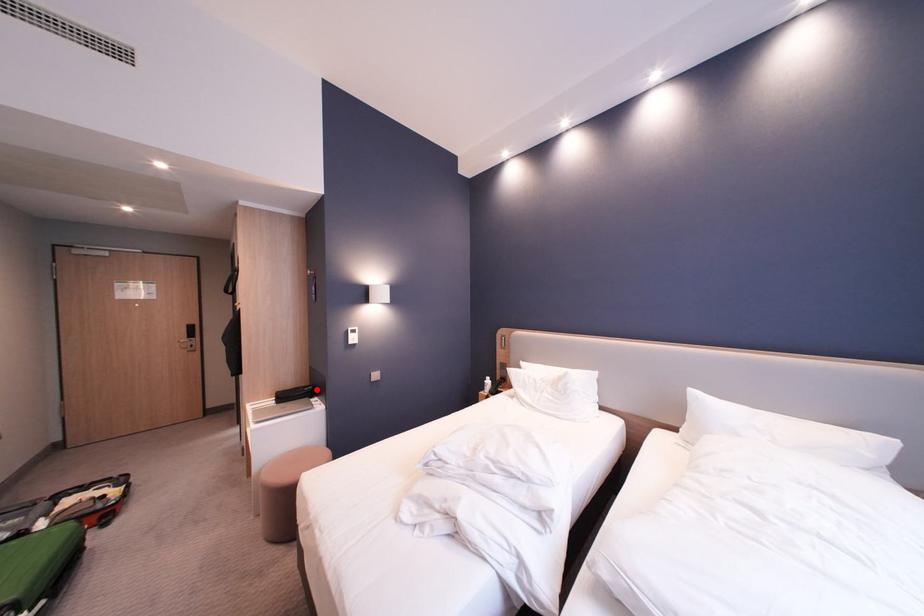
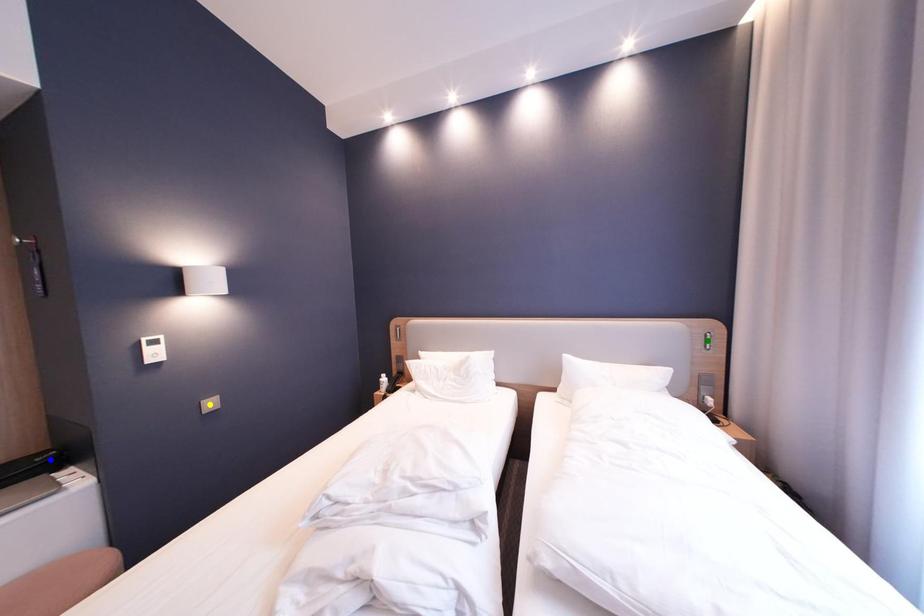
Question: I am providing you with two images of the same scene from different viewpoints. A red point is marked on the first image. You are given multiple points on the second image. In image 2, which mark is for the same physical point as the one in image 1?

Choices:
 (A) yellow point
 (B) green point
 (C) blue point

Answer: (C)